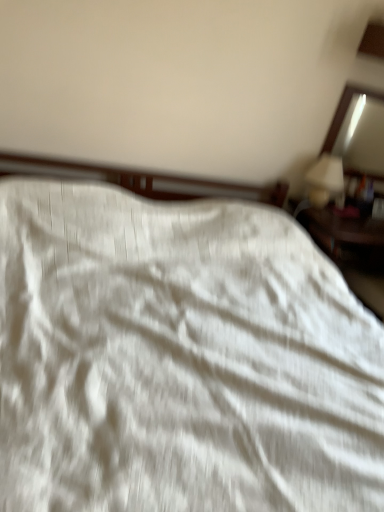
Measure the distance between white glossy table lamp at upper right and camera.

white glossy table lamp at upper right is 2.34 meters from camera.

I want to click on white textured fabric at center, so click(x=179, y=359).

Which is behind, point (28, 465) or point (320, 197)?

Point (320, 197)

Is white textured fabric at center taller than white glossy table lamp at upper right?

Yes.

Is white textured fabric at center in front of white glossy table lamp at upper right?

Yes, white textured fabric at center is closer to the camera.

Does white textured fabric at center turn towards white glossy table lamp at upper right?

No.

Is matte wooden mirror at upper right looking in the opposite direction of white textured fabric at center?

matte wooden mirror at upper right does not have its back to white textured fabric at center.

Is matte wooden mirror at upper right to the left of white textured fabric at center from the viewer's perspective?

Incorrect, matte wooden mirror at upper right is not on the left side of white textured fabric at center.

Consider the image. From a real-world perspective, is matte wooden mirror at upper right physically located above or below white textured fabric at center?

matte wooden mirror at upper right is situated higher than white textured fabric at center in the real world.

Considering the positions of points (335, 134) and (64, 323), is point (335, 134) closer to camera compared to point (64, 323)?

No, (335, 134) is further to viewer.

From a real-world perspective, which object stands above the other?

white glossy table lamp at upper right is physically above.

Looking at this image, which of these two, white glossy table lamp at upper right or white textured fabric at center, stands taller?

With more height is white textured fabric at center.

Based on the photo, which is more to the right, white glossy table lamp at upper right or white textured fabric at center?

From the viewer's perspective, white glossy table lamp at upper right appears more on the right side.

Is matte wooden mirror at upper right facing towards white glossy table lamp at upper right?

Yes, matte wooden mirror at upper right is aimed at white glossy table lamp at upper right.

Does matte wooden mirror at upper right touch white glossy table lamp at upper right?

They are not placed beside each other.

In the image, there is a matte wooden mirror at upper right. What are the coordinates of `table lamp below it (from a real-world perspective)` in the screenshot? It's located at (324, 180).

From the image's perspective, does white textured fabric at center appear higher than matte wooden mirror at upper right?

Incorrect, from the image's perspective, white textured fabric at center is lower than matte wooden mirror at upper right.

Considering the sizes of white textured fabric at center and matte wooden mirror at upper right in the image, is white textured fabric at center taller or shorter than matte wooden mirror at upper right?

Clearly, white textured fabric at center is taller compared to matte wooden mirror at upper right.

Does white textured fabric at center turn towards matte wooden mirror at upper right?

No, white textured fabric at center is not oriented towards matte wooden mirror at upper right.

Which object is wider, white textured fabric at center or matte wooden mirror at upper right?

white textured fabric at center is wider.

Are white glossy table lamp at upper right and matte wooden mirror at upper right making contact?

white glossy table lamp at upper right is not next to matte wooden mirror at upper right, and they're not touching.

Identify the location of mirror behind the white glossy table lamp at upper right. Image resolution: width=384 pixels, height=512 pixels. (346, 111).

Can you confirm if white glossy table lamp at upper right is shorter than matte wooden mirror at upper right?

Yes, white glossy table lamp at upper right is shorter than matte wooden mirror at upper right.

Is point (327, 202) positioned in front of point (348, 98)?

No, it is behind (348, 98).

This screenshot has width=384, height=512. I want to click on bed in front of the white glossy table lamp at upper right, so click(x=179, y=359).

At what (x,y) coordinates should I click in order to perform the action: click on mirror lying above the white textured fabric at center (from the image's perspective). Please return your answer as a coordinate pair (x, y). The image size is (384, 512). Looking at the image, I should click on (346, 111).

Which object lies further to the anchor point white glossy table lamp at upper right, white textured fabric at center or matte wooden mirror at upper right?

The object further to white glossy table lamp at upper right is white textured fabric at center.

Looking at the image, which one is located further to white textured fabric at center, matte wooden mirror at upper right or white glossy table lamp at upper right?

Result: matte wooden mirror at upper right is further to white textured fabric at center.

Looking at this image, which object lies further to the anchor point white textured fabric at center, white glossy table lamp at upper right or matte wooden mirror at upper right?

matte wooden mirror at upper right.

Estimate the real-world distances between objects in this image. Which object is closer to white glossy table lamp at upper right, matte wooden mirror at upper right or white textured fabric at center?

Among the two, matte wooden mirror at upper right is located nearer to white glossy table lamp at upper right.

Considering their positions, is white glossy table lamp at upper right positioned further to matte wooden mirror at upper right than white textured fabric at center?

white textured fabric at center lies further to matte wooden mirror at upper right than the other object.

When comparing their distances from matte wooden mirror at upper right, does white textured fabric at center or white glossy table lamp at upper right seem closer?

white glossy table lamp at upper right lies closer to matte wooden mirror at upper right than the other object.

Identify the location of table lamp located between white textured fabric at center and matte wooden mirror at upper right in the depth direction. This screenshot has width=384, height=512. (324, 180).